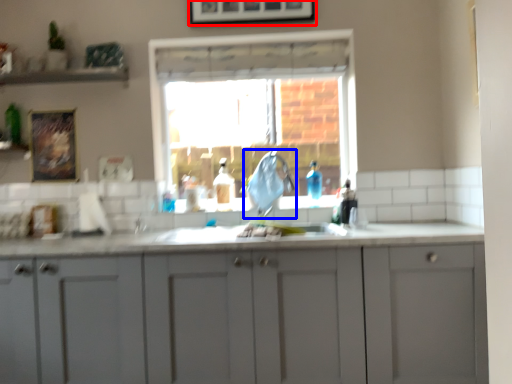
Question: Which object is closer to the camera taking this photo, picture frame (highlighted by a red box) or faucet (highlighted by a blue box)?

Choices:
 (A) picture frame
 (B) faucet

Answer: (B)